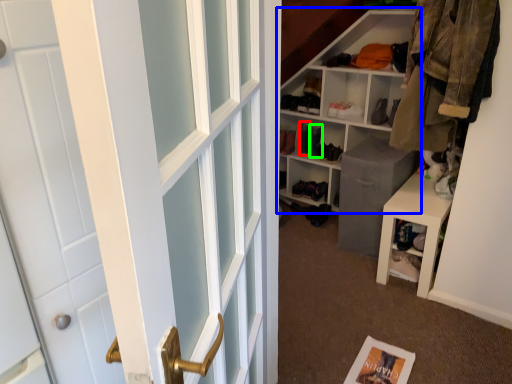
Question: Which is farther away from shoe (highlighted by a red box)? shelf (highlighted by a blue box) or shoe (highlighted by a green box)?

Choices:
 (A) shelf
 (B) shoe

Answer: (A)